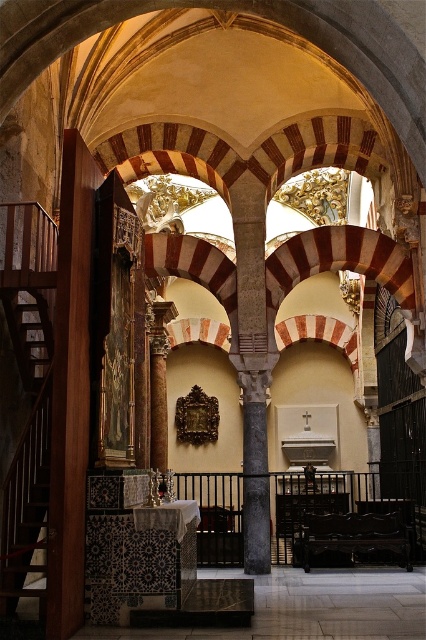
Which is behind, point (31, 468) or point (301, 540)?

Point (301, 540)

Looking at this image, does wooden staircase at left appear on the right side of polished dark wood bench at center?

Incorrect, wooden staircase at left is not on the right side of polished dark wood bench at center.

Describe the element at coordinates (25, 504) in the screenshot. I see `wooden staircase at left` at that location.

Image resolution: width=426 pixels, height=640 pixels. I want to click on wooden staircase at left, so click(x=25, y=504).